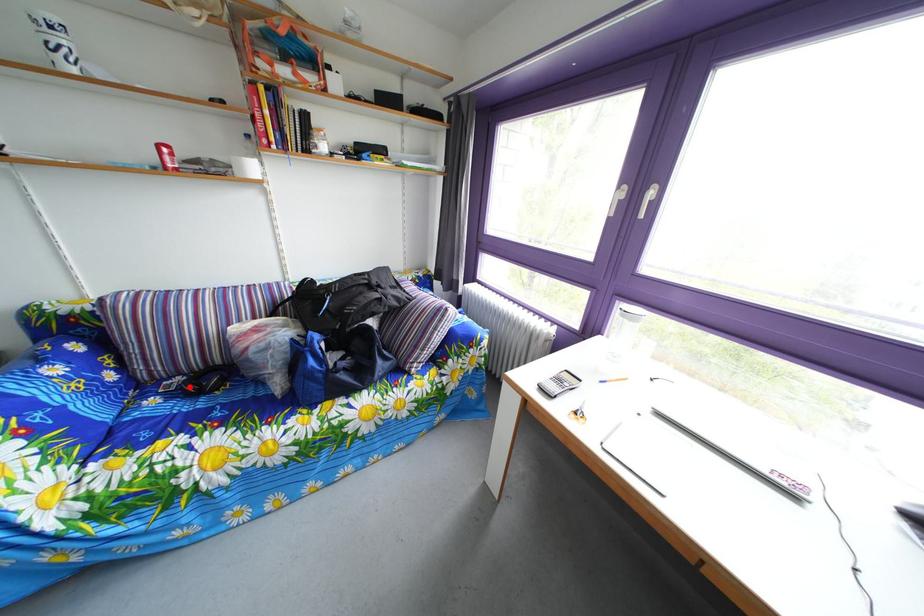
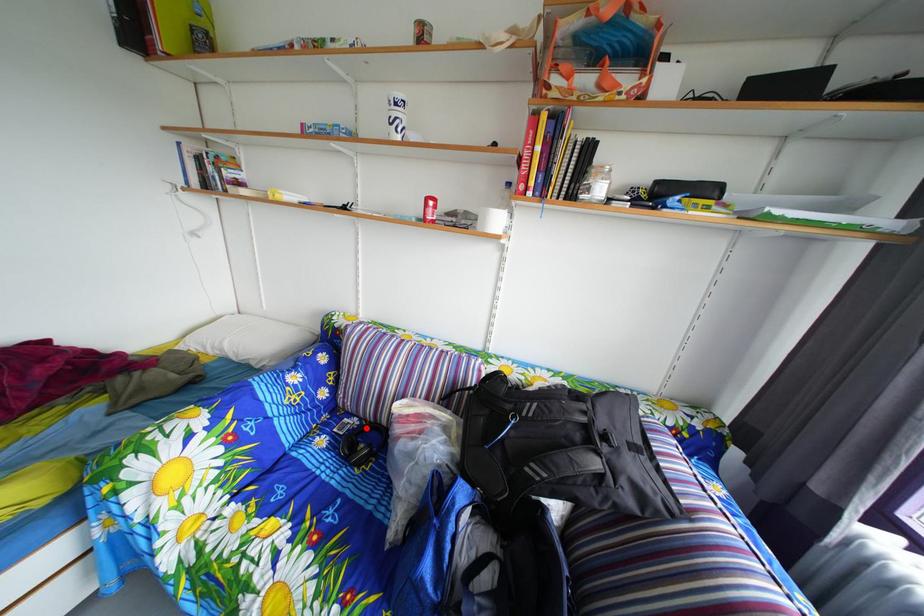
I am providing you with two images of the same scene from different viewpoints. A red point is marked on the first image and another point is marked on the second image. Do the highlighted points in image1 and image2 indicate the same real-world spot?

Yes